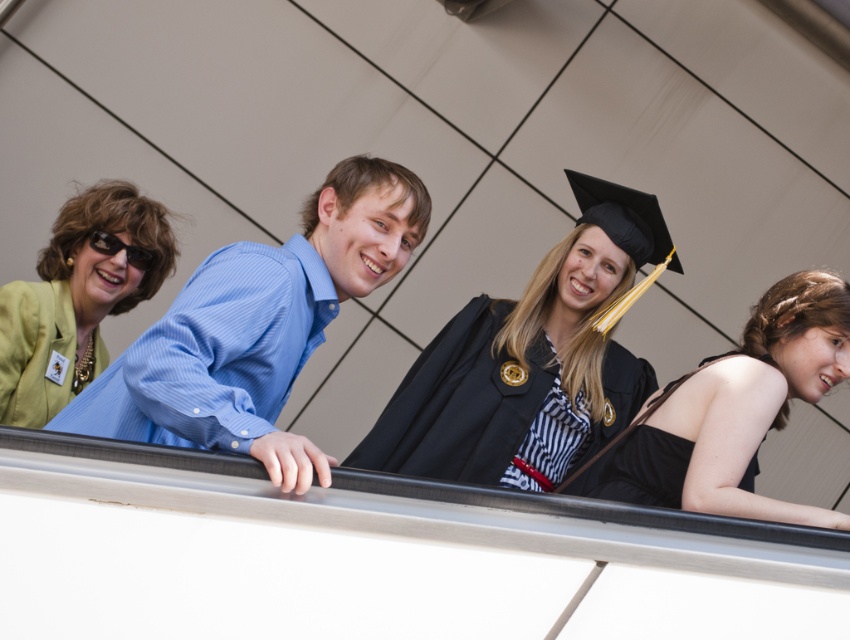
You are a photographer at a graduation ceremony. You need to position yourself so that both the black matte graduation gown at center and the black satin gown at lower right are visible in your shot. Which direction should you face to ensure both are in frame?

To include both the black matte graduation gown at center and the black satin gown at lower right in your shot, you should face towards the right side of the scene since the black matte graduation gown at center is positioned to the left of the black satin gown at lower right.

You are attending a graduation ceremony and notice two attendees wearing distinctive clothing. The first is a matte green robe at upper left, and the second is a black satin dress at center. Which of these two outfits is positioned higher in the image?

The matte green robe at upper left is located above the black satin dress at center in the image.